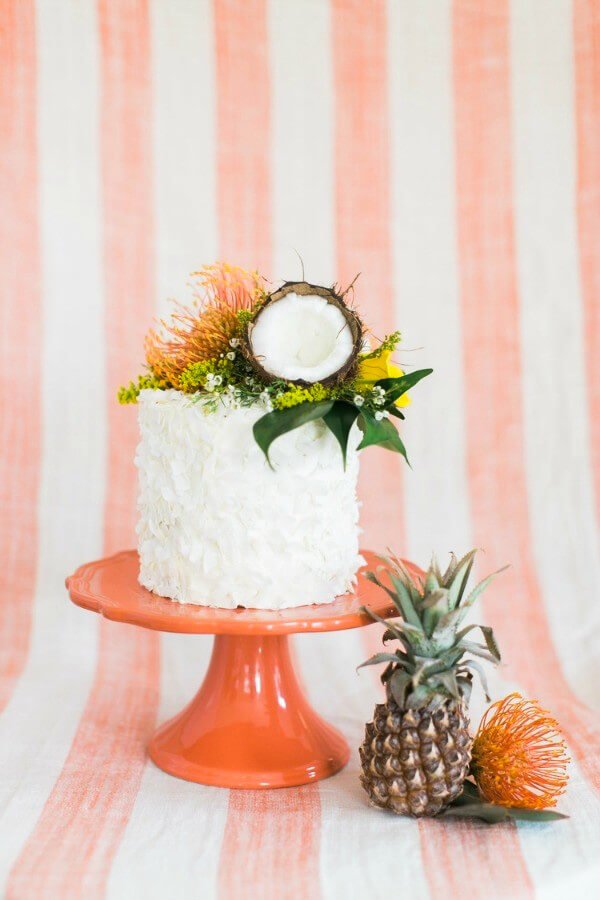
You are a GUI agent. You are given a task and a screenshot of the screen. Output one action in this format:
    pyautogui.click(x=<x>, y=<y>)
    Task: Click on the base of cake stand
    This screenshot has width=600, height=900.
    Given the screenshot: What is the action you would take?
    pyautogui.click(x=257, y=718)